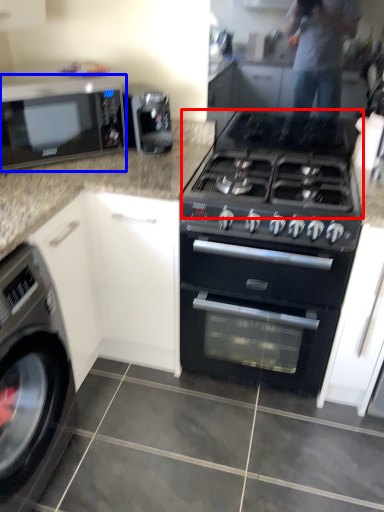
Question: Among these objects, which one is nearest to the camera, gas stove (highlighted by a red box) or microwave oven (highlighted by a blue box)?

Choices:
 (A) gas stove
 (B) microwave oven

Answer: (A)